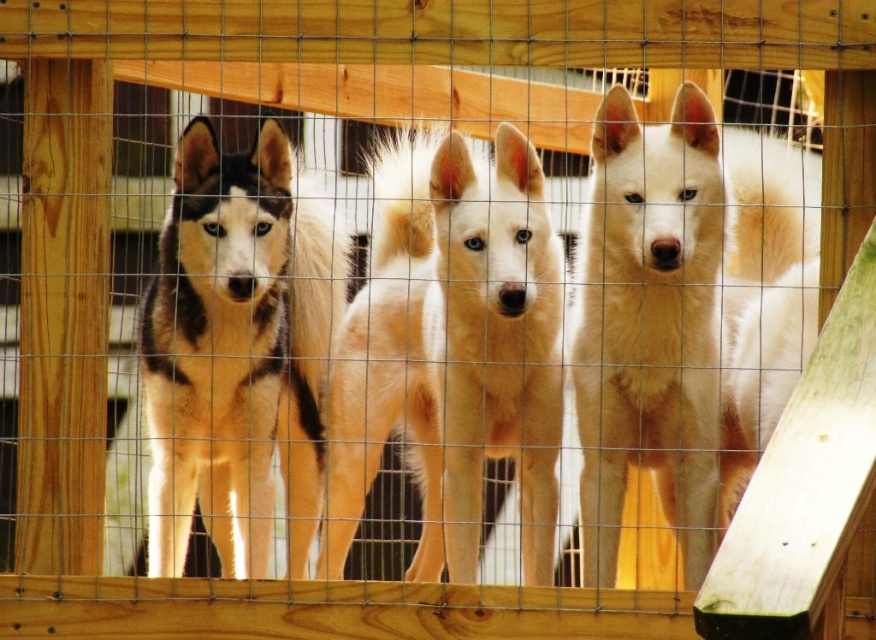
You are a dog trainer observing three husky puppies behind a wire fence. You notice a light brown fur at center and a white fluffy dog at center. How far apart are these two dogs from each other?

The light brown fur at center is 14.89 inches from white fluffy dog at center.

You are a photographer trying to capture a clear shot of both the white fluffy dog at center and the black and white fur at center. Since you want to focus on the one closer to you, which dog should you aim your camera at?

The white fluffy dog at center is closer to the viewer than the black and white fur at center, so you should aim your camera at the white fluffy dog at center to focus on the one closer to you.